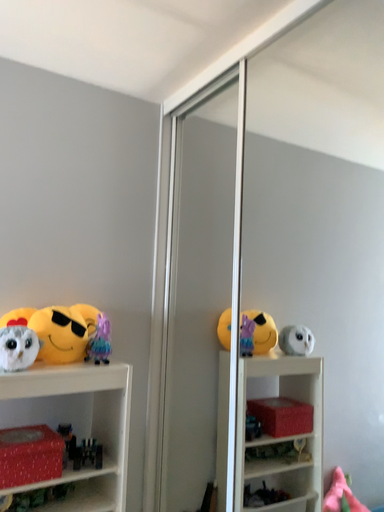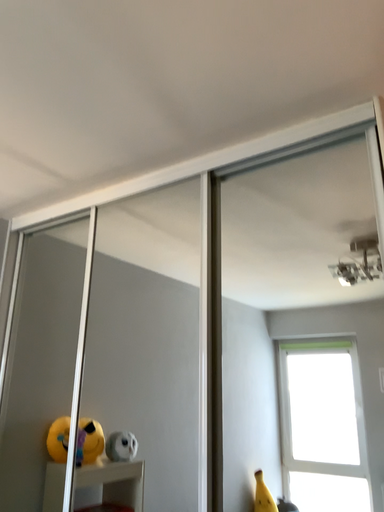
Question: Which way did the camera rotate in the video?

Choices:
 (A) rotated right
 (B) rotated left

Answer: (A)